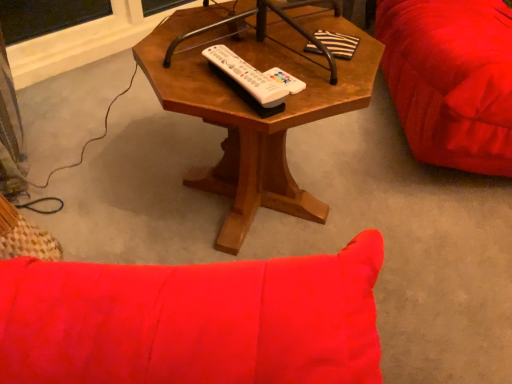
Where is `free area behind white plastic remote at center`? The image size is (512, 384). free area behind white plastic remote at center is located at coordinates (246, 45).